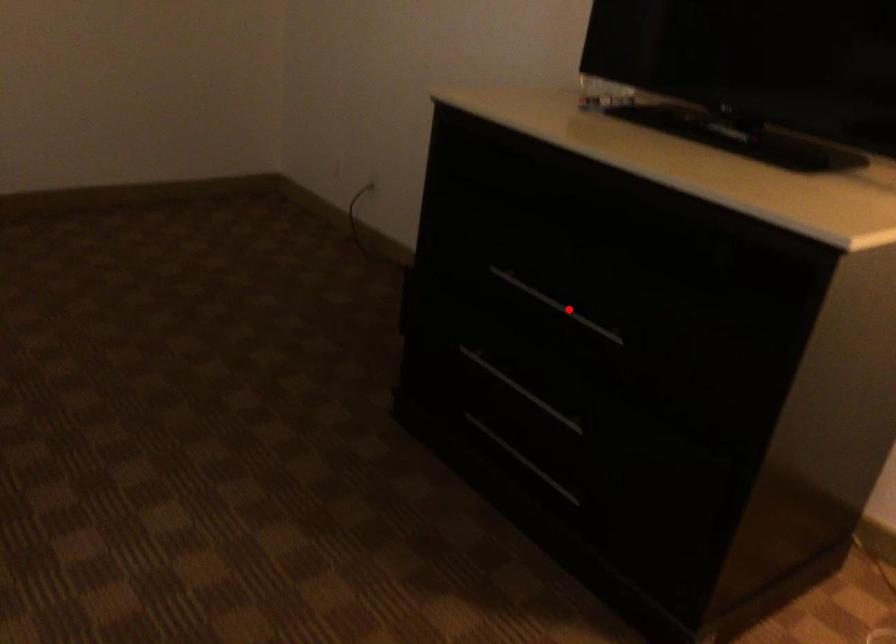
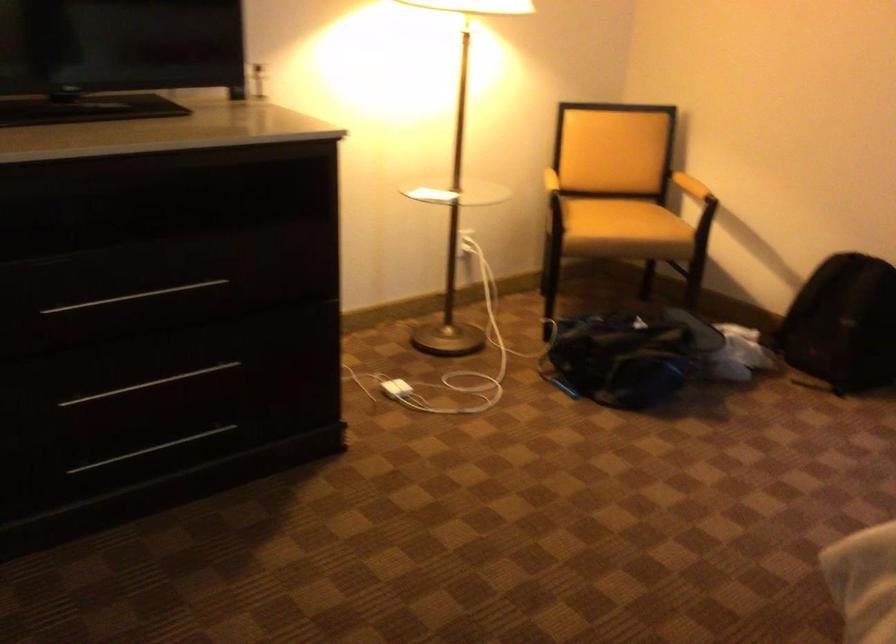
Where in the second image is the point corresponding to the highlighted location from the first image?

(134, 297)